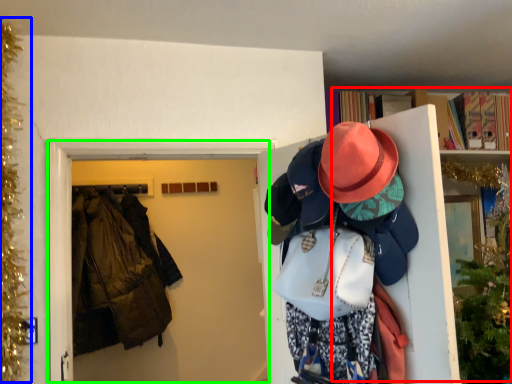
Question: Estimate the real-world distances between objects in this image. Which object is farther from bookcase (highlighted by a red box), christmas decoration (highlighted by a blue box) or door (highlighted by a green box)?

Choices:
 (A) christmas decoration
 (B) door

Answer: (A)